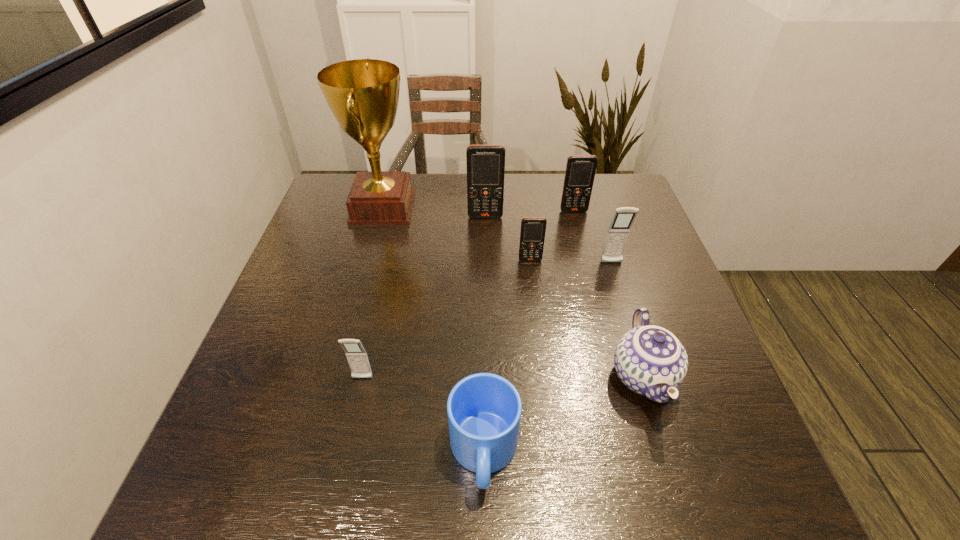
Find the location of a particular element. This screenshot has width=960, height=540. free region located 0.130m at the spout of the blue chinaware is located at coordinates (683, 503).

In order to click on award that is positioned at the far edge in this screenshot , I will do coord(363,94).

You are a GUI agent. You are given a task and a screenshot of the screen. Output one action in this format:
    pyautogui.click(x=<x>, y=<y>)
    Task: Click on the object that is at the near edge
    
    Given the screenshot: What is the action you would take?
    pyautogui.click(x=484, y=410)

The height and width of the screenshot is (540, 960). What are the coordinates of `object located at the left edge` in the screenshot? It's located at (363, 94).

Where is `cellular telephone positioned at the right edge`? The width and height of the screenshot is (960, 540). cellular telephone positioned at the right edge is located at coordinates (618, 231).

Where is `chinaware that is at the right edge`? chinaware that is at the right edge is located at coordinates (650, 360).

Locate an element on the screen. The width and height of the screenshot is (960, 540). object located in the far left corner section of the desktop is located at coordinates (363, 94).

Locate an element on the screen. Image resolution: width=960 pixels, height=540 pixels. free location at the far edge is located at coordinates (538, 197).

Locate an element on the screen. The image size is (960, 540). vacant region at the near edge is located at coordinates (300, 502).

Find the location of `vacant space at the left edge of the desktop`. vacant space at the left edge of the desktop is located at coordinates (316, 255).